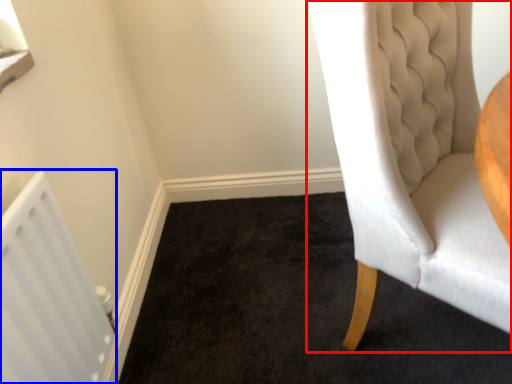
Question: Which object appears farthest to the camera in this image, chair (highlighted by a red box) or radiator (highlighted by a blue box)?

Choices:
 (A) chair
 (B) radiator

Answer: (B)